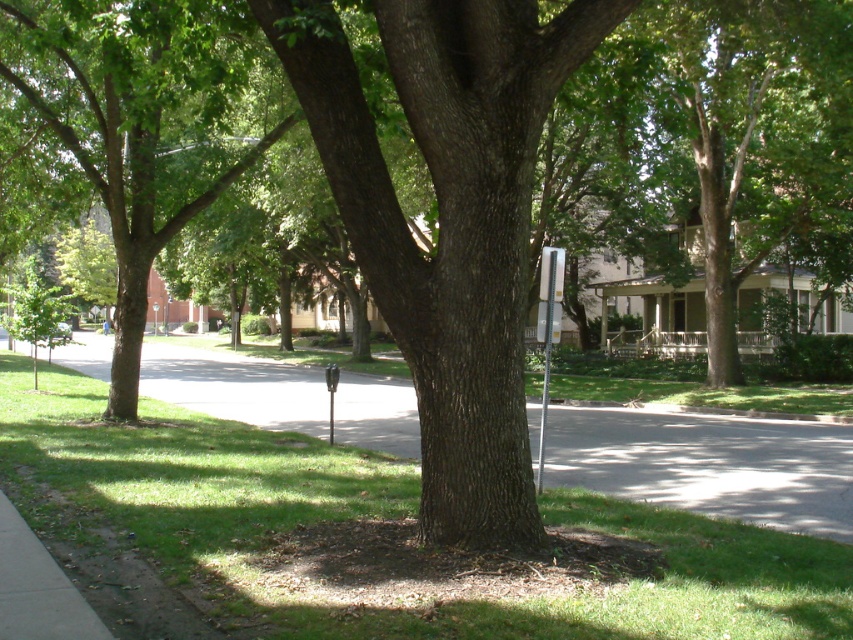
Question: Does smooth brown tree trunk at center have a lesser width compared to gray asphalt pavement at center?

Choices:
 (A) no
 (B) yes

Answer: (B)

Question: Which point is closer to the camera taking this photo?

Choices:
 (A) (543, 276)
 (B) (503, 24)

Answer: (B)

Question: Considering the real-world distances, which object is closest to the silver metallic parking sign at center-right?

Choices:
 (A) gray asphalt pavement at center
 (B) green leafy tree at center
 (C) smooth brown tree trunk at center
 (D) metallic gray parking meter at center

Answer: (C)

Question: Can you confirm if smooth brown tree trunk at center is wider than metallic gray parking meter at center?

Choices:
 (A) yes
 (B) no

Answer: (B)

Question: Does green leafy tree at center appear under metallic gray parking meter at center?

Choices:
 (A) yes
 (B) no

Answer: (B)

Question: Which of the following is the closest to the observer?

Choices:
 (A) (543, 252)
 (B) (322, 12)
 (C) (32, 20)

Answer: (B)